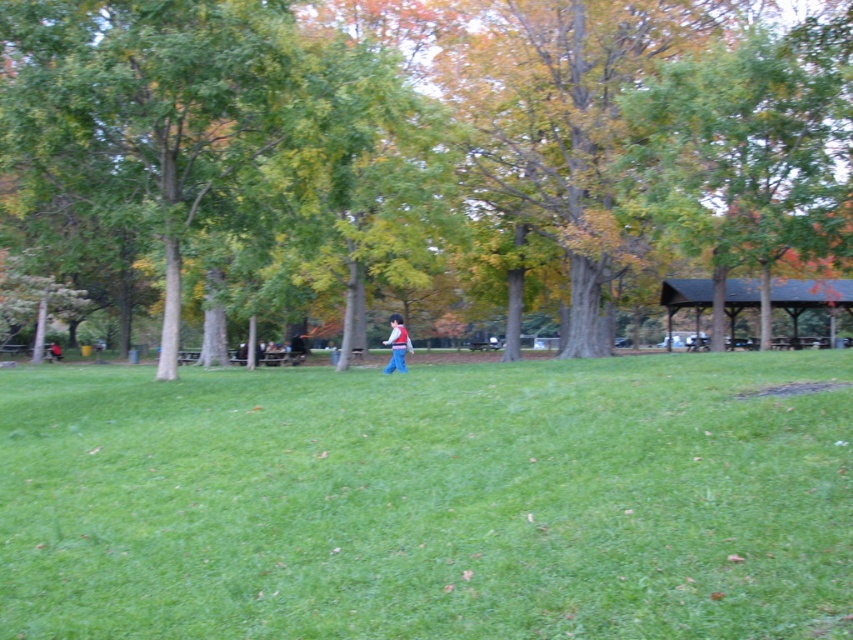
Question: Does green leafy tree at center appear over green leafy tree at right?

Choices:
 (A) yes
 (B) no

Answer: (A)

Question: Which object is positioned closest to the green grassy field at center?

Choices:
 (A) matte red vest at center
 (B) green leafy tree at center
 (C) green leafy tree at right

Answer: (A)

Question: Which point appears farthest from the camera in this image?

Choices:
 (A) tap(779, 179)
 (B) tap(606, 147)
 (C) tap(402, 349)
 (D) tap(822, 413)

Answer: (B)

Question: Does green grassy field at center have a smaller size compared to matte red vest at center?

Choices:
 (A) no
 (B) yes

Answer: (B)

Question: Is green leafy tree at right bigger than matte red vest at center?

Choices:
 (A) no
 (B) yes

Answer: (B)

Question: Which point appears farthest from the camera in this image?

Choices:
 (A) (403, 352)
 (B) (306, 426)
 (C) (535, 141)
 (D) (699, 157)

Answer: (C)